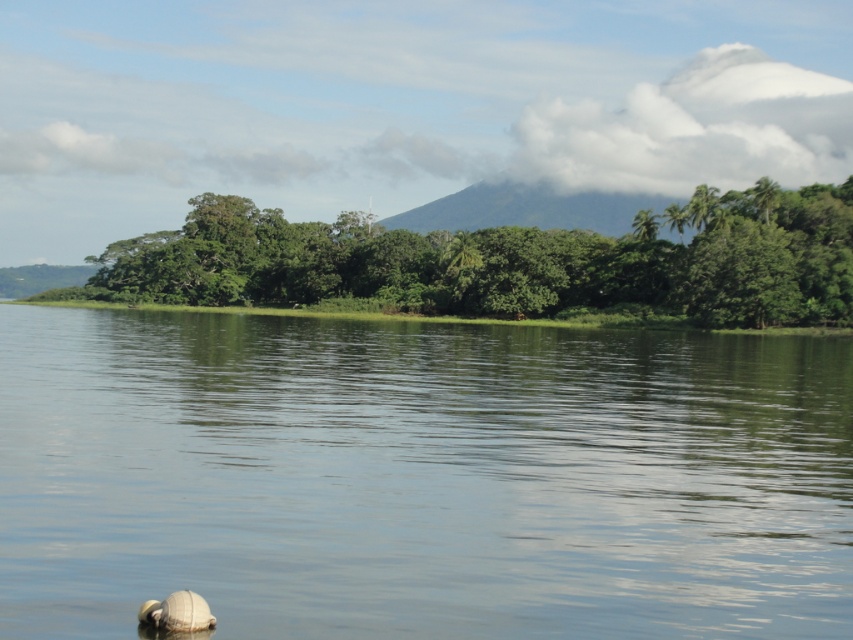
Can you confirm if green smooth water at center is smaller than green leafy trees at center?

Indeed, green smooth water at center has a smaller size compared to green leafy trees at center.

Measure the distance between point (109, 404) and camera.

A distance of 89.40 feet exists between point (109, 404) and camera.

Locate an element on the screen. green smooth water at center is located at coordinates (421, 477).